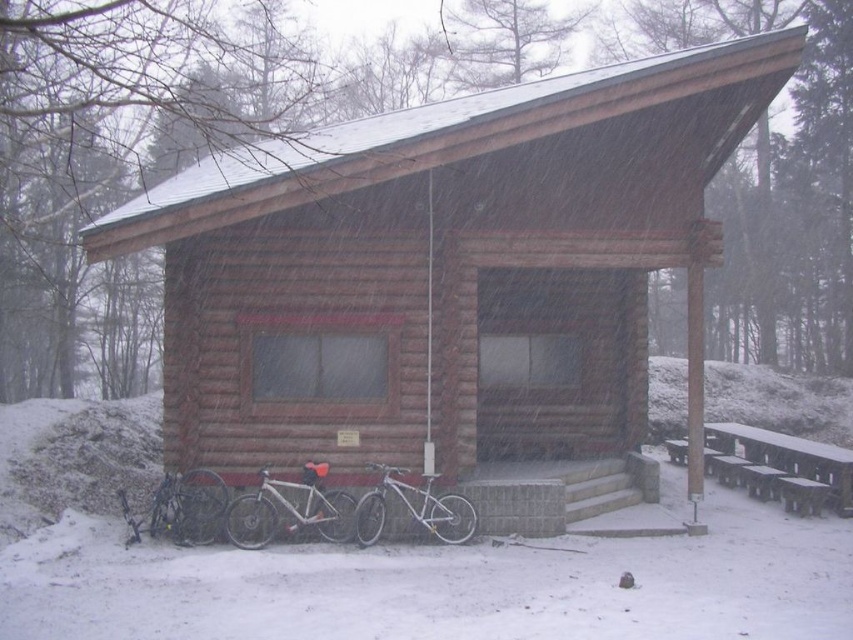
Where is `brown wooden cabin at center`? The image size is (853, 640). brown wooden cabin at center is located at coordinates (445, 269).

Is brown wooden cabin at center behind wooden picnic table at lower right?

No.

Locate an element on the screen. brown wooden cabin at center is located at coordinates (445, 269).

In order to click on brown wooden cabin at center in this screenshot , I will do 445,269.

The image size is (853, 640). Describe the element at coordinates (445, 269) in the screenshot. I see `brown wooden cabin at center` at that location.

Which is below, brown wooden cabin at center or silver metallic bicycle at lower center?

silver metallic bicycle at lower center

Is point (225, 444) positioned after point (363, 529)?

Yes.

Identify the location of brown wooden cabin at center. Image resolution: width=853 pixels, height=640 pixels. (445, 269).

Which is in front, point (225, 492) or point (445, 544)?

Point (225, 492)

Which is below, shiny metallic bicycle at lower left or silver metallic bicycle at lower center?

shiny metallic bicycle at lower left is lower down.

Is point (155, 515) farther from camera compared to point (363, 516)?

Yes, it is behind point (363, 516).

Find the location of a particular element. The height and width of the screenshot is (640, 853). shiny metallic bicycle at lower left is located at coordinates (181, 508).